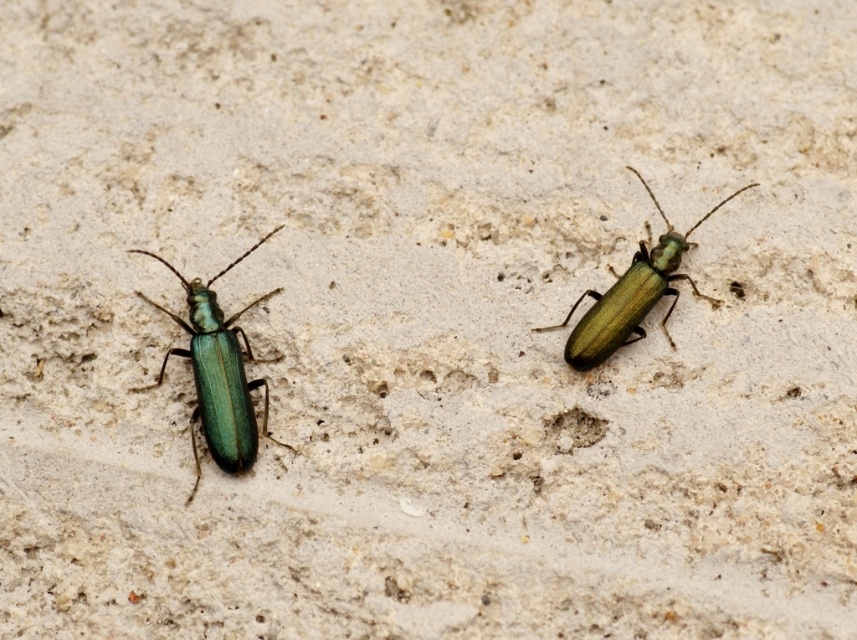
Who is positioned more to the left, metallic green beetle at left or metallic green beetle at center-right?

metallic green beetle at left

Is metallic green beetle at left further to camera compared to metallic green beetle at center-right?

That is False.

This screenshot has width=857, height=640. Describe the element at coordinates (219, 372) in the screenshot. I see `metallic green beetle at left` at that location.

What are the coordinates of `metallic green beetle at left` in the screenshot? It's located at (219, 372).